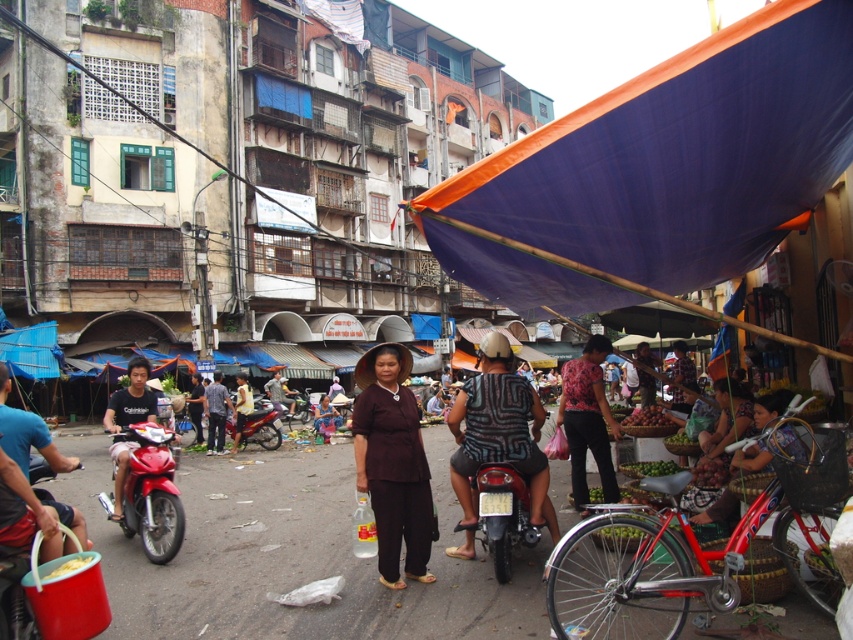
You are standing in the middle of the street market and want to take a photo of both the point at coordinates (407, 493) and the point at coordinates (482, 516). Which point should you focus on first to ensure both are in clear view?

You should focus on point (407, 493) first because it is closer to you than point (482, 516), ensuring both points are in clear view.